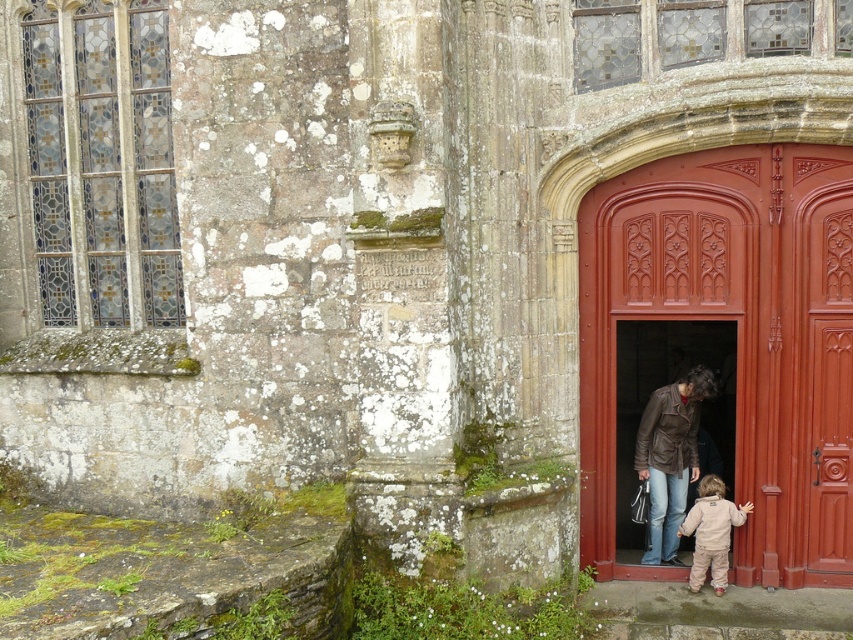
Who is lower down, smooth polished wood door at center right or light brown fleece jacket at lower right?

light brown fleece jacket at lower right is below.

Is point (734, 220) positioned in front of point (698, 500)?

Yes.

Where is `smooth polished wood door at center right`? smooth polished wood door at center right is located at coordinates (726, 342).

Is point (664, 480) positioned behind point (726, 524)?

Yes, point (664, 480) is behind point (726, 524).

Can you confirm if brown leather jacket at center is positioned above light brown fleece jacket at lower right?

Correct, brown leather jacket at center is located above light brown fleece jacket at lower right.

Is point (705, 380) closer to viewer compared to point (697, 557)?

No, (705, 380) is further to viewer.

Find the location of a particular element. This screenshot has width=853, height=640. brown leather jacket at center is located at coordinates (670, 458).

Does point (621, 340) lie in front of point (651, 397)?

That is False.

Who is more distant from viewer, (x=740, y=467) or (x=653, y=465)?

The point (x=653, y=465) is behind.

Locate an element on the screen. The width and height of the screenshot is (853, 640). smooth polished wood door at center right is located at coordinates (726, 342).